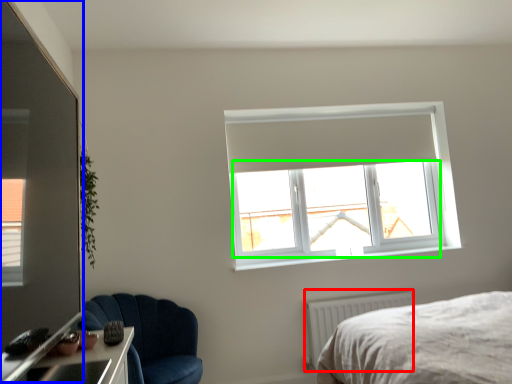
Question: Which object is the farthest from radiator (highlighted by a red box)? Choose among these: glass door (highlighted by a blue box) or window screen (highlighted by a green box).

Choices:
 (A) glass door
 (B) window screen

Answer: (A)